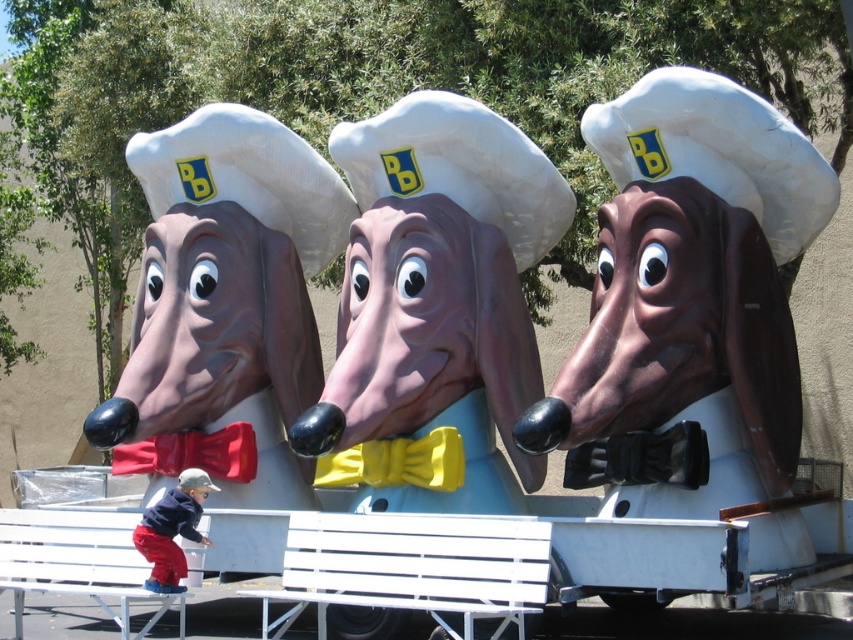
Is point (396, 257) closer to viewer compared to point (229, 477)?

Yes, it is in front of point (229, 477).

Does matte plastic sausage at center appear under yellow satin bow tie at lower center?

Actually, matte plastic sausage at center is above yellow satin bow tie at lower center.

Which is behind, point (328, 609) or point (242, 422)?

The point (242, 422) is behind.

Where is `matte plastic sausage at center`? This screenshot has width=853, height=640. matte plastic sausage at center is located at coordinates (434, 308).

The width and height of the screenshot is (853, 640). Find the location of `white painted wood park bench at lower center`. white painted wood park bench at lower center is located at coordinates (412, 566).

Where is `white painted wood park bench at lower center`? white painted wood park bench at lower center is located at coordinates (412, 566).

At what (x,y) coordinates should I click in order to perform the action: click on white painted wood park bench at lower center. Please return your answer as a coordinate pair (x, y). Looking at the image, I should click on (412, 566).

Between brown matte dog head at center and white painted wood park bench at lower center, which one appears on the right side from the viewer's perspective?

Positioned to the right is brown matte dog head at center.

Which of these two, brown matte dog head at center or white painted wood park bench at lower center, stands shorter?

Standing shorter between the two is white painted wood park bench at lower center.

At what (x,y) coordinates should I click in order to perform the action: click on brown matte dog head at center. Please return your answer as a coordinate pair (x, y). The height and width of the screenshot is (640, 853). Looking at the image, I should click on (692, 312).